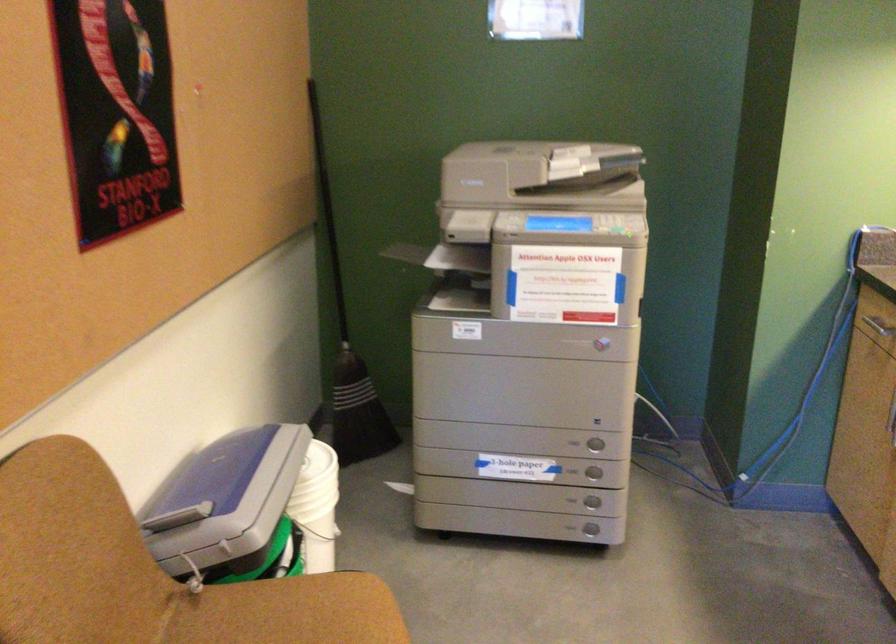
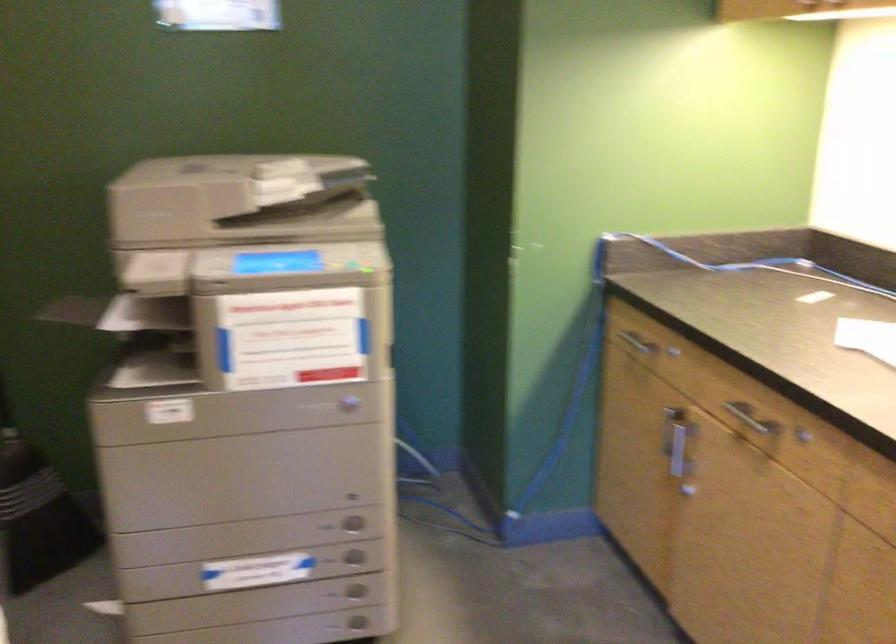
Question: Which direction would the cameraman need to move to produce the second image? Reply with the corresponding letter.

Choices:
 (A) Left
 (B) Right
 (C) Forward
 (D) Backward

Answer: (C)